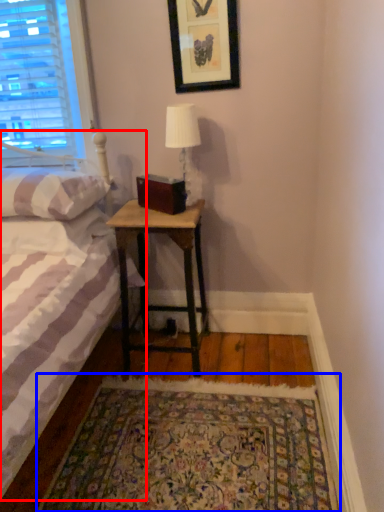
Question: Which object is closer to the camera taking this photo, bed (highlighted by a red box) or mat (highlighted by a blue box)?

Choices:
 (A) bed
 (B) mat

Answer: (A)